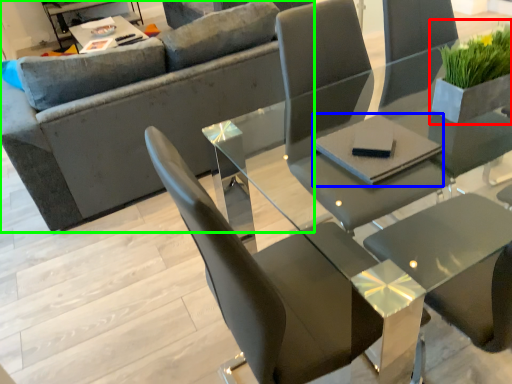
Question: Which object is positioned closest to houseplant (highlighted by a red box)? Select from pad (highlighted by a blue box) and studio couch (highlighted by a green box).

Choices:
 (A) pad
 (B) studio couch

Answer: (A)